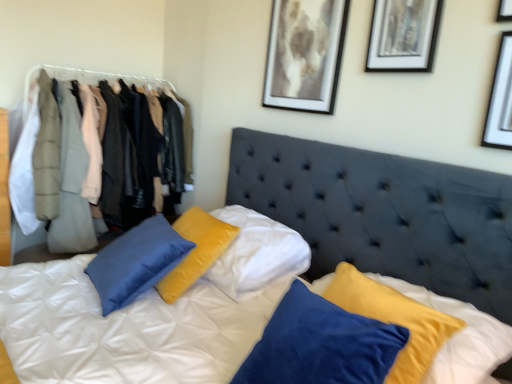
Question: Does matte black picture frame at upper center, marked as the first picture frame in a left-to-right arrangement, come in front of matte gray coat at left, which ranks as the first clothing in back-to-front order?

Choices:
 (A) yes
 (B) no

Answer: (A)

Question: From a real-world perspective, is matte black picture frame at upper center, marked as the 3th picture frame in a right-to-left arrangement, located higher than matte gray coat at left, placed as the second clothing when sorted from front to back?

Choices:
 (A) yes
 (B) no

Answer: (A)

Question: Considering the relative sizes of matte black picture frame at upper center, marked as the 3th picture frame in a right-to-left arrangement, and matte gray coat at left, which ranks as the first clothing in back-to-front order, in the image provided, is matte black picture frame at upper center, marked as the 3th picture frame in a right-to-left arrangement, taller than matte gray coat at left, which ranks as the first clothing in back-to-front order,?

Choices:
 (A) no
 (B) yes

Answer: (A)

Question: Considering the relative sizes of matte black picture frame at upper center, placed as the first picture frame when sorted from back to front, and matte gray coat at left, placed as the second clothing when sorted from front to back, in the image provided, is matte black picture frame at upper center, placed as the first picture frame when sorted from back to front, wider than matte gray coat at left, placed as the second clothing when sorted from front to back,?

Choices:
 (A) yes
 (B) no

Answer: (B)

Question: Can you confirm if matte black picture frame at upper center, marked as the 3th picture frame in a right-to-left arrangement, is positioned to the left of matte gray coat at left, which ranks as the first clothing in back-to-front order?

Choices:
 (A) no
 (B) yes

Answer: (A)

Question: Is matte black picture frame at upper center, placed as the first picture frame when sorted from back to front, further to camera compared to matte gray coat at left, placed as the second clothing when sorted from front to back?

Choices:
 (A) yes
 (B) no

Answer: (B)

Question: From a real-world perspective, does light beige fabric coat at left, marked as the 1th clothing in a front-to-back arrangement, stand above matte black picture frame at upper center, the third picture frame positioned from the front?

Choices:
 (A) no
 (B) yes

Answer: (A)

Question: Does light beige fabric coat at left, the 2th clothing when ordered from back to front, come in front of matte black picture frame at upper center, marked as the first picture frame in a left-to-right arrangement?

Choices:
 (A) yes
 (B) no

Answer: (B)

Question: From a real-world perspective, does light beige fabric coat at left, marked as the 1th clothing in a front-to-back arrangement, sit lower than matte black picture frame at upper center, placed as the first picture frame when sorted from back to front?

Choices:
 (A) no
 (B) yes

Answer: (B)

Question: Considering the relative sizes of light beige fabric coat at left, marked as the 1th clothing in a front-to-back arrangement, and matte black picture frame at upper center, marked as the first picture frame in a left-to-right arrangement, in the image provided, is light beige fabric coat at left, marked as the 1th clothing in a front-to-back arrangement, bigger than matte black picture frame at upper center, marked as the first picture frame in a left-to-right arrangement,?

Choices:
 (A) no
 (B) yes

Answer: (B)

Question: Can you confirm if light beige fabric coat at left, the 2th clothing when ordered from back to front, is wider than matte black picture frame at upper center, marked as the 3th picture frame in a right-to-left arrangement?

Choices:
 (A) no
 (B) yes

Answer: (B)

Question: Does light beige fabric coat at left, marked as the 1th clothing in a front-to-back arrangement, have a lesser width compared to matte black picture frame at upper center, marked as the 3th picture frame in a right-to-left arrangement?

Choices:
 (A) no
 (B) yes

Answer: (A)

Question: Would you say suede-like dark blue headboard at center is outside white matte picture frame at upper right, which is counted as the 3th picture frame, starting from the left?

Choices:
 (A) no
 (B) yes

Answer: (B)